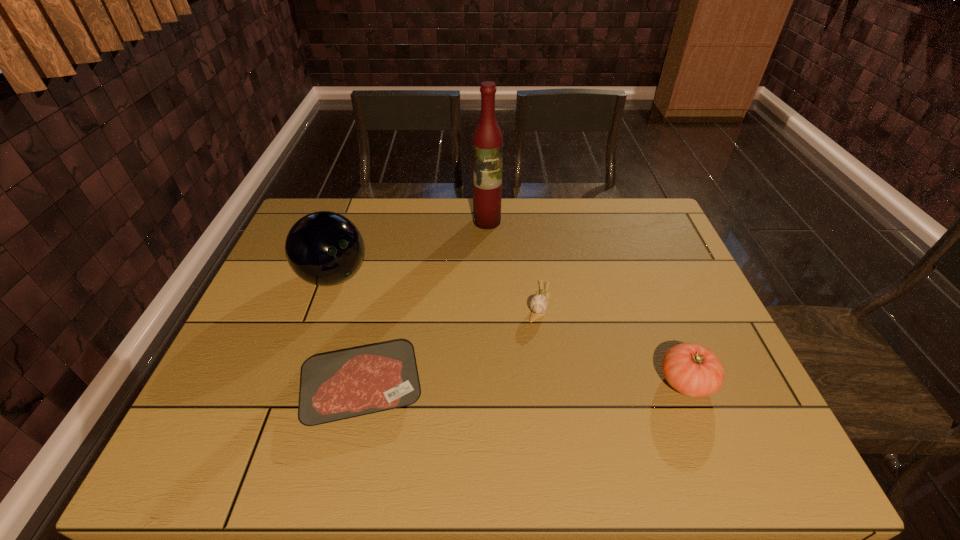
This screenshot has height=540, width=960. In order to click on steak in this screenshot , I will do `click(339, 385)`.

What are the coordinates of `the rightmost object` in the screenshot? It's located at (691, 369).

The width and height of the screenshot is (960, 540). I want to click on tomato, so click(691, 369).

Where is `escargot`? escargot is located at coordinates (539, 303).

Where is `the second shortest object`? The image size is (960, 540). the second shortest object is located at coordinates (539, 303).

Find the location of a particular element. bowling ball is located at coordinates (323, 248).

Locate an element on the screen. the tallest object is located at coordinates (487, 143).

At what (x,y) coordinates should I click in order to perform the action: click on the third object from right to left. Please return your answer as a coordinate pair (x, y). Looking at the image, I should click on (487, 143).

Locate an element on the screen. The height and width of the screenshot is (540, 960). free space located 0.110m on the left of the steak is located at coordinates (252, 388).

Identify the location of free space located on the back of the tomato. (663, 323).